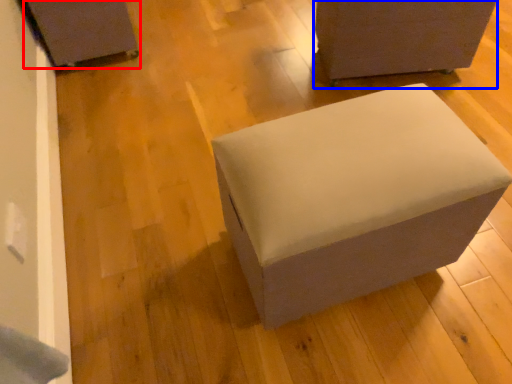
Question: Which of the following is the closest to the observer, furniture (highlighted by a red box) or furniture (highlighted by a blue box)?

Choices:
 (A) furniture
 (B) furniture

Answer: (B)